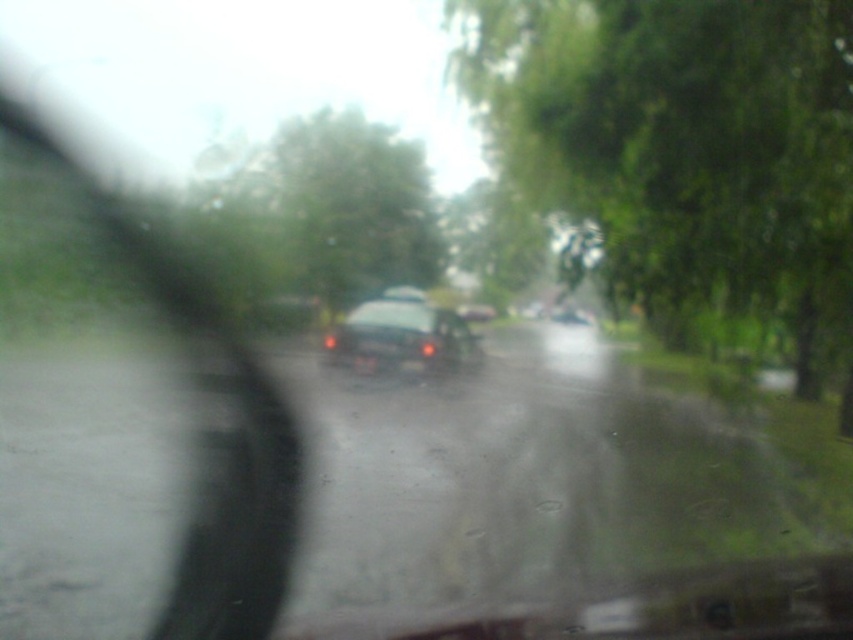
Question: Considering the relative positions of green leafy tree at upper right and transparent plastic mirror at left in the image provided, where is green leafy tree at upper right located with respect to transparent plastic mirror at left?

Choices:
 (A) left
 (B) right

Answer: (B)

Question: Which object is closer to the camera taking this photo?

Choices:
 (A) transparent plastic mirror at left
 (B) glossy black car at center

Answer: (A)

Question: Is green leafy tree at upper right smaller than glossy black car at center?

Choices:
 (A) yes
 (B) no

Answer: (B)

Question: Which point appears closest to the camera in this image?

Choices:
 (A) (799, 243)
 (B) (277, 556)

Answer: (B)

Question: Which point is farther from the camera taking this photo?

Choices:
 (A) (624, 269)
 (B) (366, 346)
 (C) (233, 390)

Answer: (A)

Question: Is transparent plastic mirror at left closer to camera compared to glossy black car at center?

Choices:
 (A) yes
 (B) no

Answer: (A)